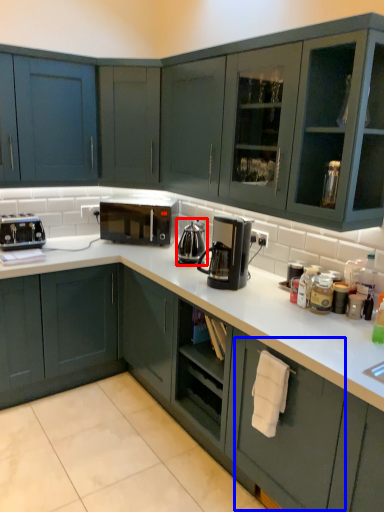
Question: Among these objects, which one is nearest to the camera, coffeepot (highlighted by a red box) or drawer (highlighted by a blue box)?

Choices:
 (A) coffeepot
 (B) drawer

Answer: (B)